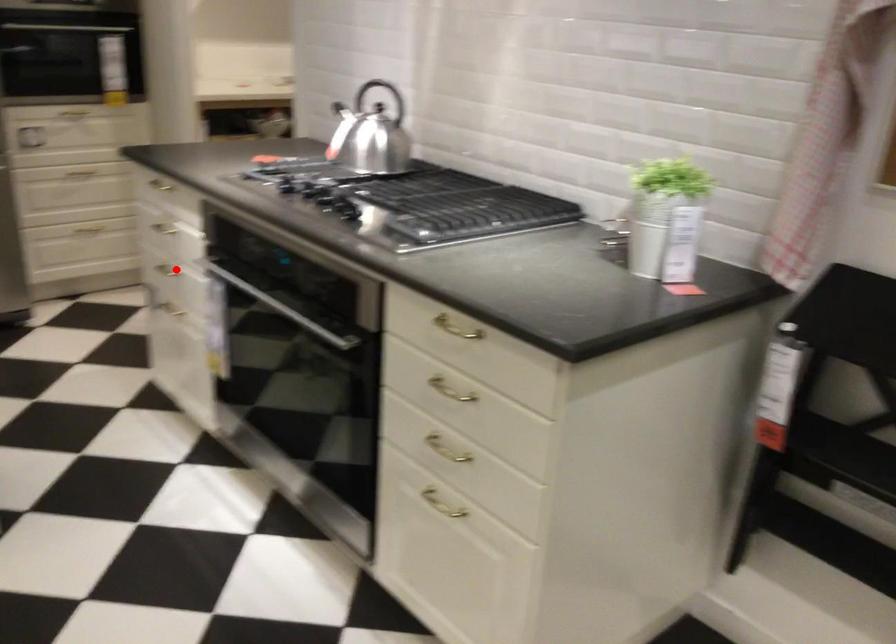
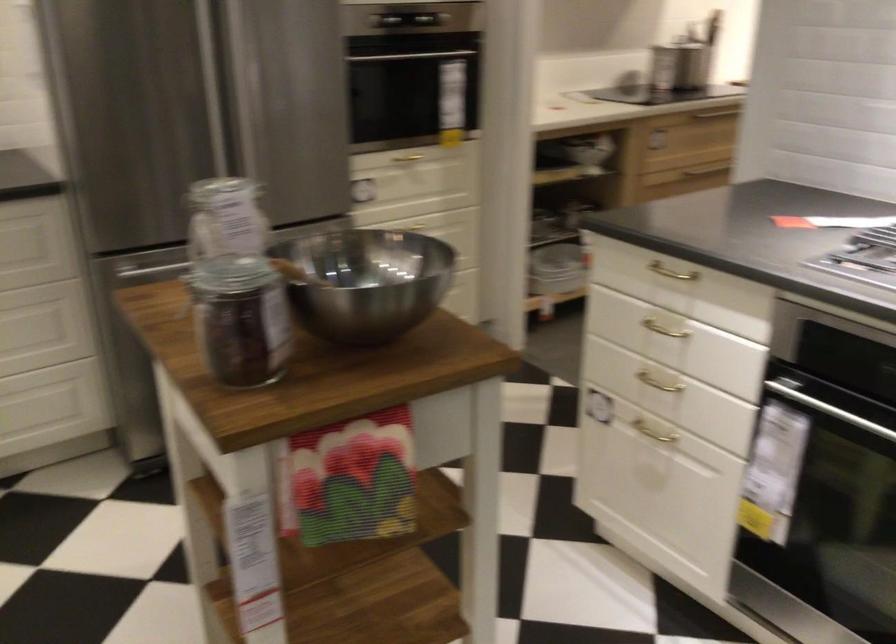
Question: A red point is marked in image1. In image2, is the corresponding 3D point closer to the camera or farther? Reply with the corresponding letter.

Choices:
 (A) The corresponding 3D point is closer.
 (B) The corresponding 3D point is farther.

Answer: (A)